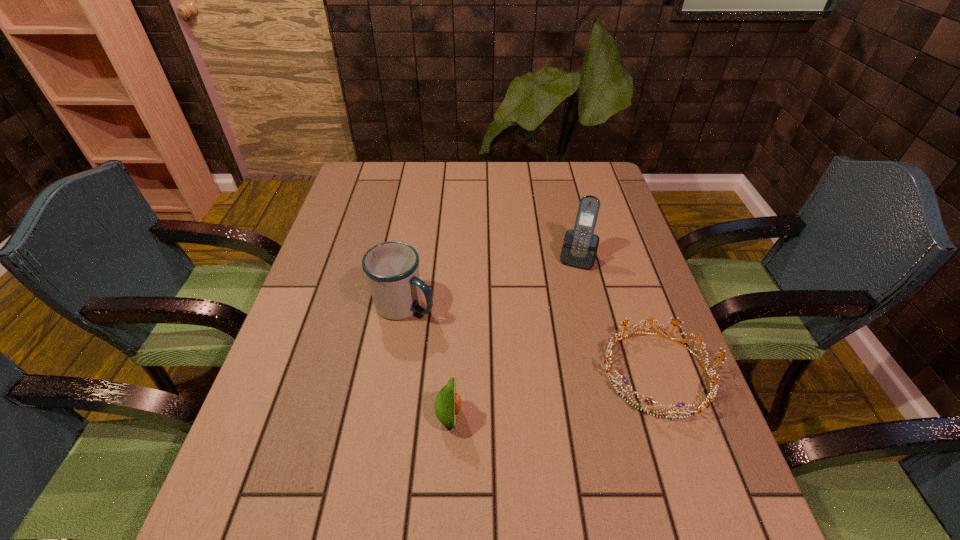
Identify the location of vacant spot on the desktop that is between the avocado and the shortest object and is positioned on the handle side of the second tallest object. This screenshot has height=540, width=960. (580, 389).

Identify the location of free space on the desktop that is between the third object from right to left and the tiara and is positioned on the front-facing side of the cellular telephone. The image size is (960, 540). (531, 400).